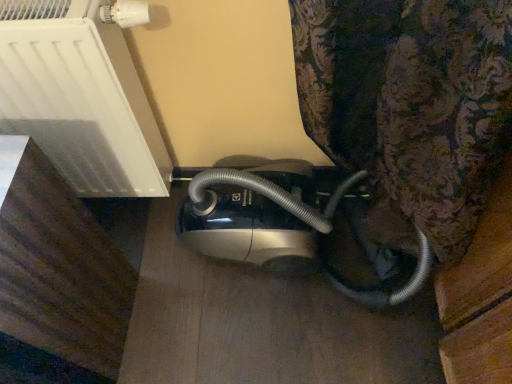
Question: Relative to metallic silver vacuum cleaner at center, is satin silver vacuum cleaner at lower center in front or behind?

Choices:
 (A) behind
 (B) front

Answer: (B)

Question: From the image's perspective, is satin silver vacuum cleaner at lower center above or below metallic silver vacuum cleaner at center?

Choices:
 (A) above
 (B) below

Answer: (A)

Question: From a real-world perspective, is satin silver vacuum cleaner at lower center physically located above or below metallic silver vacuum cleaner at center?

Choices:
 (A) above
 (B) below

Answer: (A)

Question: Looking at the image, does metallic silver vacuum cleaner at center seem bigger or smaller compared to satin silver vacuum cleaner at lower center?

Choices:
 (A) big
 (B) small

Answer: (A)

Question: Would you say metallic silver vacuum cleaner at center is to the left or to the right of satin silver vacuum cleaner at lower center in the picture?

Choices:
 (A) right
 (B) left

Answer: (A)

Question: From the image's perspective, is metallic silver vacuum cleaner at center positioned above or below satin silver vacuum cleaner at lower center?

Choices:
 (A) below
 (B) above

Answer: (A)

Question: Is point (194, 235) positioned closer to the camera than point (26, 13)?

Choices:
 (A) closer
 (B) farther

Answer: (B)